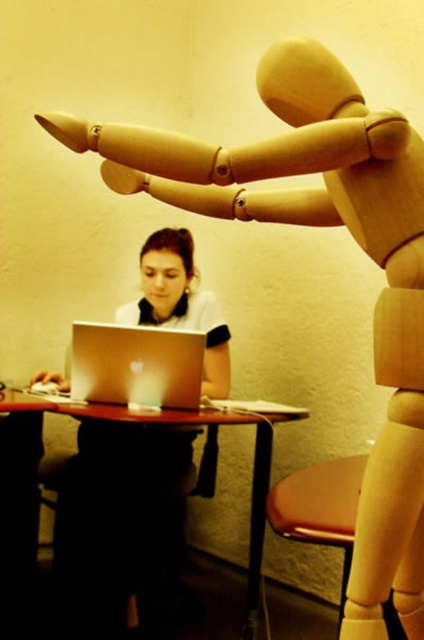
Can you confirm if matte white laptop at center is smaller than silver metallic laptop at center?

No, matte white laptop at center is not smaller than silver metallic laptop at center.

Does matte white laptop at center appear under silver metallic laptop at center?

Yes, matte white laptop at center is below silver metallic laptop at center.

Image resolution: width=424 pixels, height=640 pixels. Find the location of `matte white laptop at center`. matte white laptop at center is located at coordinates (122, 518).

Is point (139, 563) closer to camera compared to point (208, 410)?

No, it is behind (208, 410).

Does matte white laptop at center appear under wooden table at lower center?

No.

Is point (145, 484) in front of point (98, 410)?

That is False.

Where is `matte white laptop at center`? The image size is (424, 640). matte white laptop at center is located at coordinates (122, 518).

Does silver metallic laptop at center have a greater height compared to wooden table at lower center?

No, silver metallic laptop at center is not taller than wooden table at lower center.

Can you confirm if silver metallic laptop at center is thinner than wooden table at lower center?

Indeed, silver metallic laptop at center has a lesser width compared to wooden table at lower center.

This screenshot has height=640, width=424. I want to click on silver metallic laptop at center, so click(136, 365).

This screenshot has height=640, width=424. Find the location of `silver metallic laptop at center`. silver metallic laptop at center is located at coordinates (136, 365).